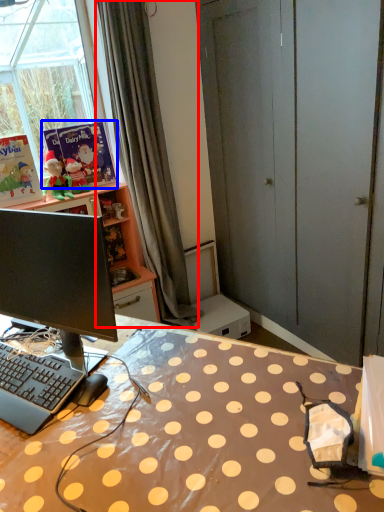
Question: Which point is closer to the camera, curtain (highlighted by a red box) or book (highlighted by a blue box)?

Choices:
 (A) curtain
 (B) book

Answer: (A)